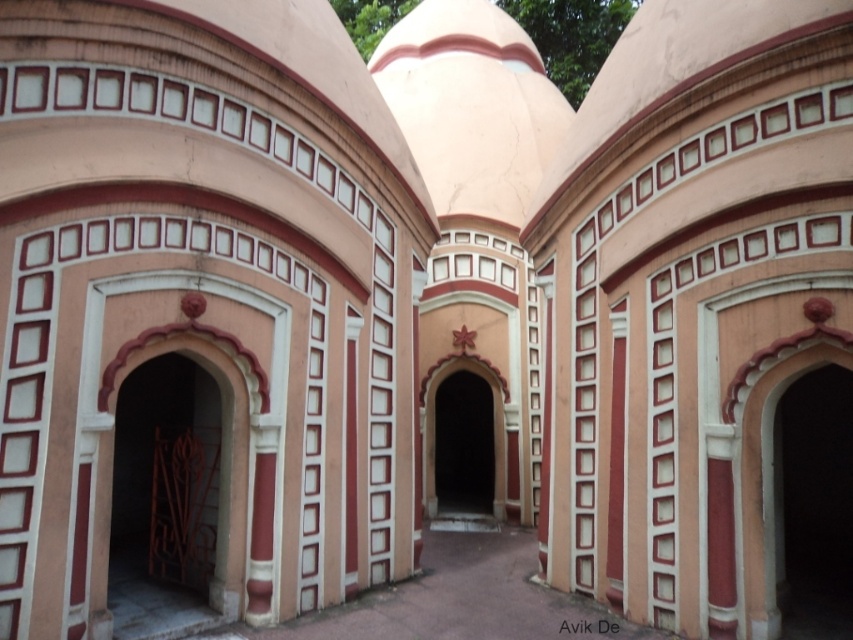
Question: Can you confirm if pink stone archway at right is positioned to the right of smooth pink archway at center?

Choices:
 (A) no
 (B) yes

Answer: (B)

Question: From the image, what is the correct spatial relationship of polished metal gate at left in relation to pink stone archway at right?

Choices:
 (A) above
 (B) below

Answer: (A)

Question: Which object is positioned closest to the pink stone archway at right?

Choices:
 (A) smooth pink archway at center
 (B) polished metal gate at left

Answer: (A)

Question: Does polished metal gate at left appear over pink stone archway at right?

Choices:
 (A) no
 (B) yes

Answer: (B)

Question: Which of these objects is positioned closest to the pink stone archway at right?

Choices:
 (A) polished metal gate at left
 (B) smooth pink archway at center

Answer: (B)

Question: Which point is closer to the camera?

Choices:
 (A) (120, 531)
 (B) (799, 390)

Answer: (A)